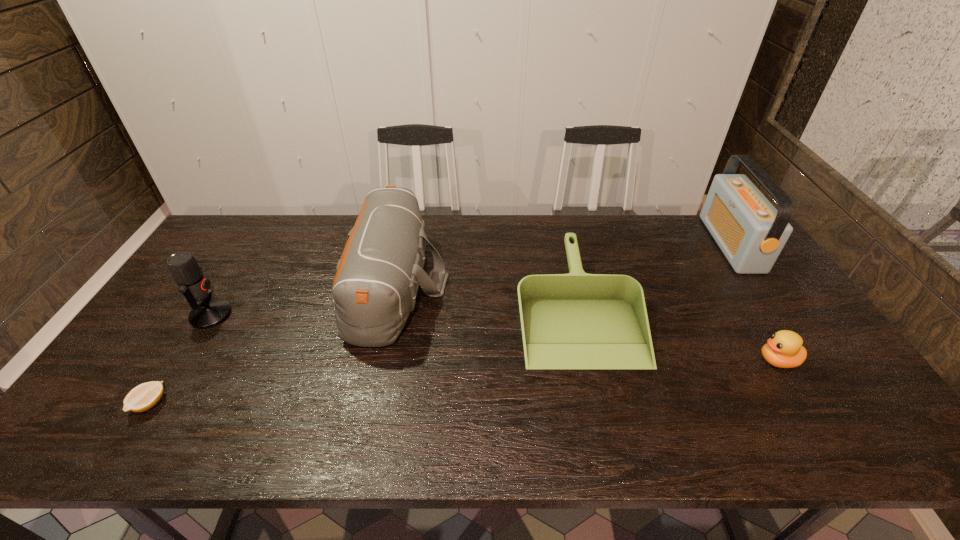
Locate an element on the screen. The image size is (960, 540). radio receiver is located at coordinates (751, 233).

This screenshot has height=540, width=960. Identify the location of the fourth object from right to left. (376, 281).

Image resolution: width=960 pixels, height=540 pixels. What are the coordinates of `microphone` in the screenshot? It's located at (185, 270).

Identify the location of the third object from right to left. (577, 320).

Identify the location of duckling. The height and width of the screenshot is (540, 960). (784, 349).

The width and height of the screenshot is (960, 540). I want to click on lemon, so click(x=144, y=396).

This screenshot has height=540, width=960. I want to click on the nearest object, so click(x=144, y=396).

Where is `blank space located on the front-facing side of the tallest object`? blank space located on the front-facing side of the tallest object is located at coordinates (685, 244).

You are a GUI agent. You are given a task and a screenshot of the screen. Output one action in this format:
    pyautogui.click(x=<x>, y=<y>)
    Task: Click on the vacant space situated on the front-facing side of the tallest object
    This screenshot has height=540, width=960.
    Given the screenshot: What is the action you would take?
    pyautogui.click(x=698, y=244)

Where is `blank space located on the front-facing side of the tallest object`? blank space located on the front-facing side of the tallest object is located at coordinates (677, 244).